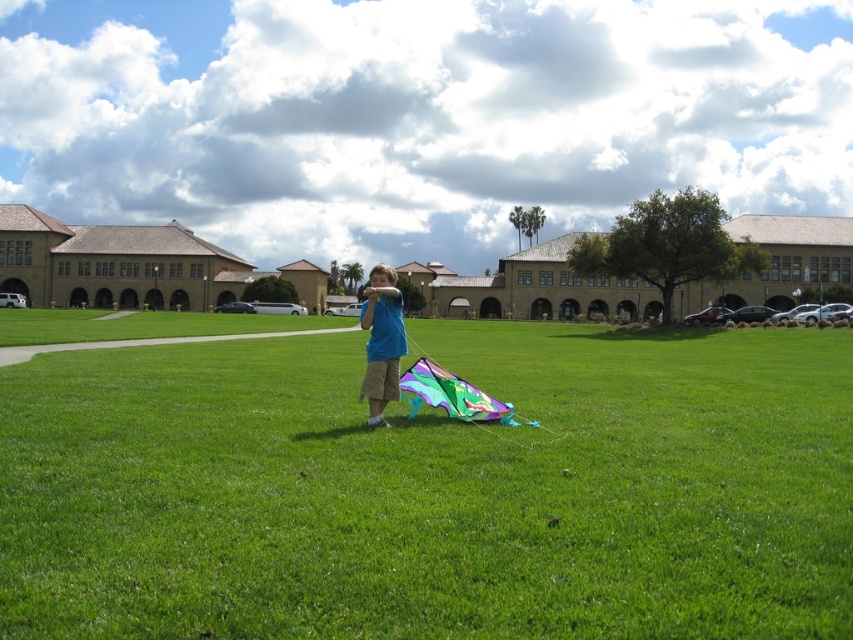
Does multicolored kite at center appear over multicolored fabric kite at center?

Yes, multicolored kite at center is above multicolored fabric kite at center.

Is multicolored kite at center shorter than multicolored fabric kite at center?

Yes, multicolored kite at center is shorter than multicolored fabric kite at center.

Does point (509, 364) lie behind point (448, 394)?

Yes, point (509, 364) is behind point (448, 394).

At what (x,y) coordinates should I click in order to perform the action: click on multicolored kite at center. Please return your answer as a coordinate pair (x, y). Looking at the image, I should click on (433, 490).

Does blue cotton shirt at center appear over multicolored fabric kite at center?

Correct, blue cotton shirt at center is located above multicolored fabric kite at center.

At what (x,y) coordinates should I click in order to perform the action: click on blue cotton shirt at center. Please return your answer as a coordinate pair (x, y). Image resolution: width=853 pixels, height=640 pixels. Looking at the image, I should click on (381, 340).

Locate an element on the screen. Image resolution: width=853 pixels, height=640 pixels. blue cotton shirt at center is located at coordinates (381, 340).

Is point (636, 490) closer to viewer compared to point (405, 346)?

Yes, it is.

Measure the distance between point (151, 499) and camera.

Point (151, 499) is 18.44 feet from camera.

Find the location of a particular element. The width and height of the screenshot is (853, 640). multicolored kite at center is located at coordinates (433, 490).